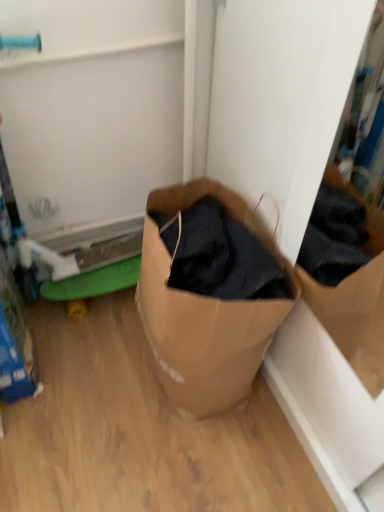
Question: Considering the positions of brown paper bag at center and green rubber toy at lower left in the image, is brown paper bag at center wider or thinner than green rubber toy at lower left?

Choices:
 (A) thin
 (B) wide

Answer: (B)

Question: Is point (190, 387) closer or farther from the camera than point (97, 275)?

Choices:
 (A) closer
 (B) farther

Answer: (A)

Question: From their relative heights in the image, would you say brown paper bag at center is taller or shorter than green rubber toy at lower left?

Choices:
 (A) short
 (B) tall

Answer: (B)

Question: Looking at their shapes, would you say green rubber toy at lower left is wider or thinner than brown paper bag at center?

Choices:
 (A) wide
 (B) thin

Answer: (B)

Question: Looking at the image, does green rubber toy at lower left seem bigger or smaller compared to brown paper bag at center?

Choices:
 (A) big
 (B) small

Answer: (B)

Question: Is green rubber toy at lower left taller or shorter than brown paper bag at center?

Choices:
 (A) tall
 (B) short

Answer: (B)

Question: Is point coord(134,276) positioned closer to the camera than point coord(213,353)?

Choices:
 (A) farther
 (B) closer

Answer: (A)